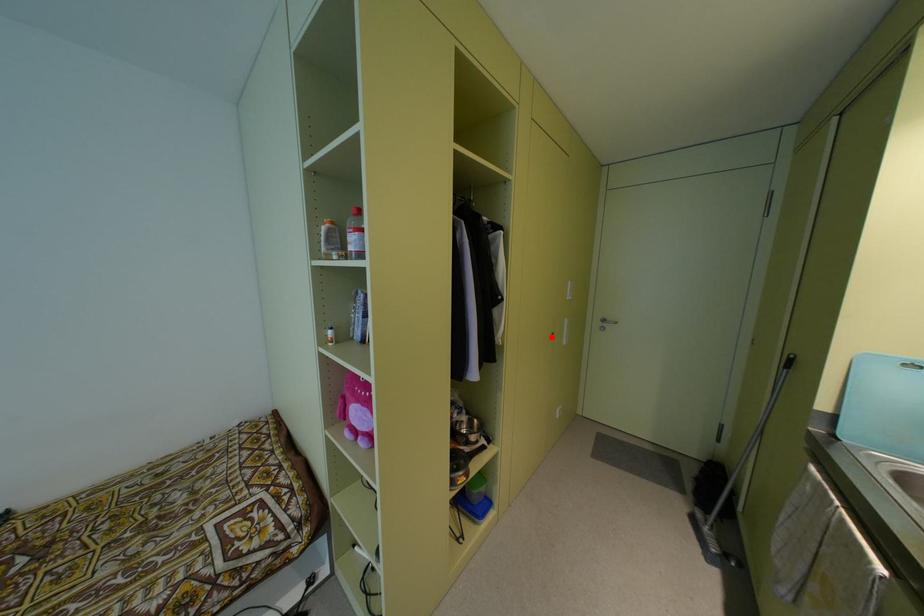
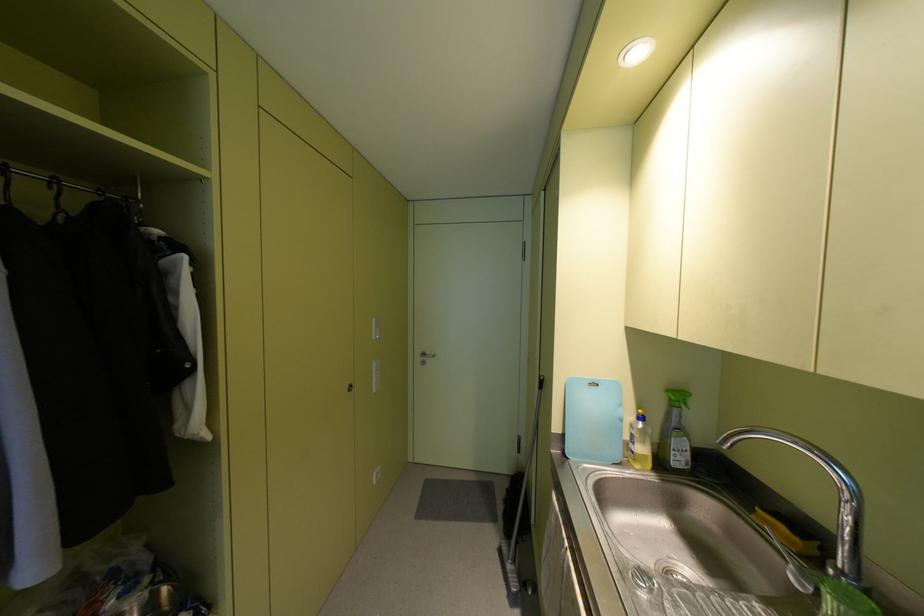
Question: I am providing you with two images of the same scene from different viewpoints. Given a red point in image1, look at the same physical point in image2. Is it:

Choices:
 (A) Closer to the viewpoint
 (B) Farther from the viewpoint

Answer: (A)